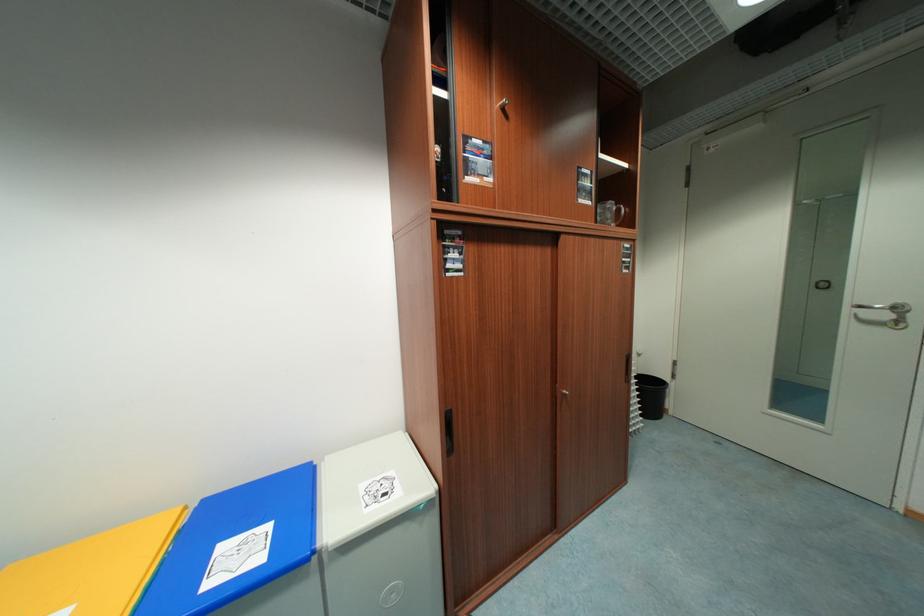
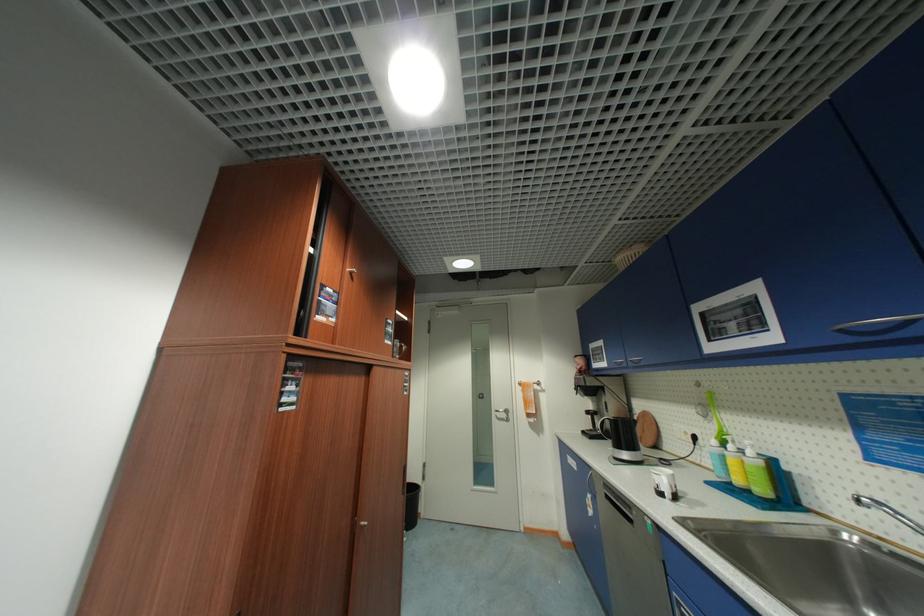
Find the pixel in the second image that matches point (659, 387) in the first image.

(418, 493)